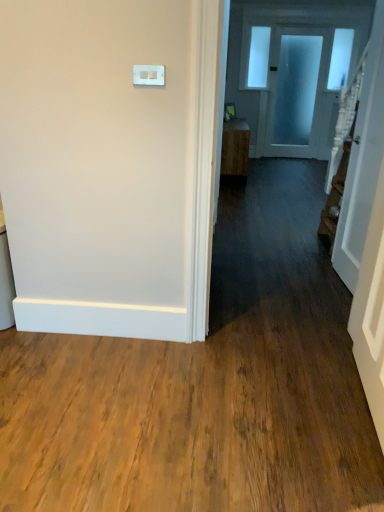
Question: Is white glossy door at right, positioned as the 2th door in top-to-bottom order, shorter than white plastic light switch at upper center?

Choices:
 (A) yes
 (B) no

Answer: (B)

Question: Is white glossy door at right, acting as the first door starting from the front, located outside white plastic light switch at upper center?

Choices:
 (A) no
 (B) yes

Answer: (B)

Question: Considering the relative sizes of white glossy door at right, acting as the first door starting from the front, and white plastic light switch at upper center in the image provided, is white glossy door at right, acting as the first door starting from the front, bigger than white plastic light switch at upper center?

Choices:
 (A) yes
 (B) no

Answer: (A)

Question: Can you confirm if white glossy door at right, the first door when ordered from bottom to top, is positioned to the left of white plastic light switch at upper center?

Choices:
 (A) yes
 (B) no

Answer: (B)

Question: Is white plastic light switch at upper center surrounded by white glossy door at right, acting as the first door starting from the front?

Choices:
 (A) no
 (B) yes

Answer: (A)

Question: From the image's perspective, would you say white glossy door at right, arranged as the 1th door when viewed from the left, is shown under white plastic light switch at upper center?

Choices:
 (A) no
 (B) yes

Answer: (B)

Question: Considering the relative sizes of wooden cabinet at center and frosted glass door at upper center, the 1th door from the top, in the image provided, is wooden cabinet at center thinner than frosted glass door at upper center, the 1th door from the top,?

Choices:
 (A) no
 (B) yes

Answer: (A)

Question: Considering the relative sizes of wooden cabinet at center and frosted glass door at upper center, placed as the 1th door when sorted from back to front, in the image provided, is wooden cabinet at center taller than frosted glass door at upper center, placed as the 1th door when sorted from back to front,?

Choices:
 (A) yes
 (B) no

Answer: (B)

Question: Is wooden cabinet at center located outside frosted glass door at upper center, which appears as the 2th door when viewed from the front?

Choices:
 (A) yes
 (B) no

Answer: (A)

Question: Can you confirm if wooden cabinet at center is positioned to the left of frosted glass door at upper center, the 1th door from the top?

Choices:
 (A) no
 (B) yes

Answer: (B)

Question: From the image's perspective, is wooden cabinet at center beneath frosted glass door at upper center, which is the second door in left-to-right order?

Choices:
 (A) yes
 (B) no

Answer: (A)

Question: Is wooden cabinet at center placed right next to frosted glass door at upper center, which appears as the 2th door when viewed from the front?

Choices:
 (A) yes
 (B) no

Answer: (B)

Question: Could you tell me if white glossy door at right, which is the second door from right to left, is facing wooden cabinet at center?

Choices:
 (A) no
 (B) yes

Answer: (A)